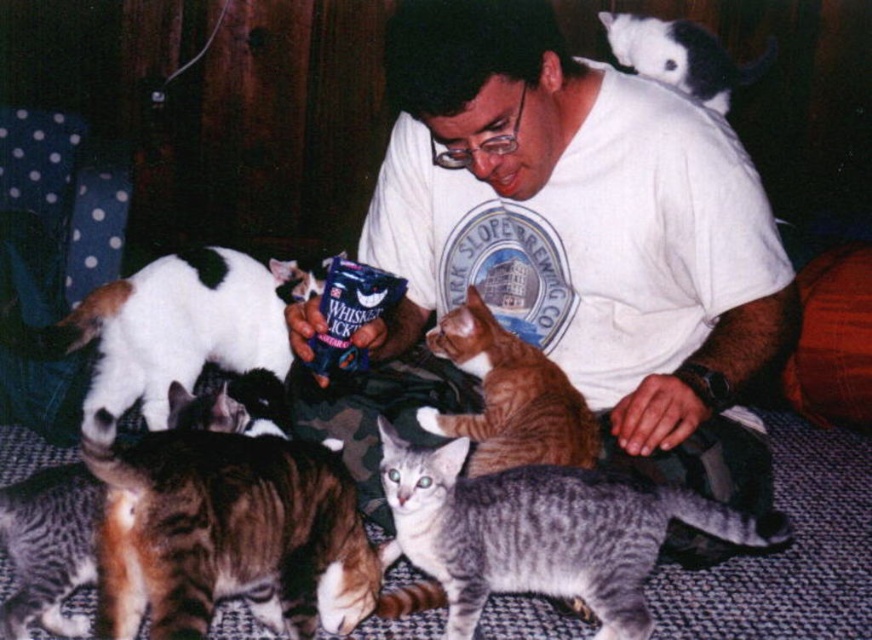
Is the position of white fur cat at left less distant than that of orange tabby cat at center?

No, it is not.

This screenshot has height=640, width=872. I want to click on white fur cat at left, so 182,324.

Can you confirm if gray striped cat at lower center is taller than white and black fur cat at upper right?

In fact, gray striped cat at lower center may be shorter than white and black fur cat at upper right.

Who is higher up, gray striped cat at lower center or white and black fur cat at upper right?

white and black fur cat at upper right is higher up.

Locate an element on the screen. gray striped cat at lower center is located at coordinates (537, 534).

Does orange tabby cat at center appear under white and black fur cat at upper right?

Indeed, orange tabby cat at center is positioned under white and black fur cat at upper right.

Between orange tabby cat at center and white and black fur cat at upper right, which one has more height?

With more height is white and black fur cat at upper right.

Does point (523, 458) come in front of point (760, 61)?

That is True.

The height and width of the screenshot is (640, 872). Identify the location of orange tabby cat at center. (509, 396).